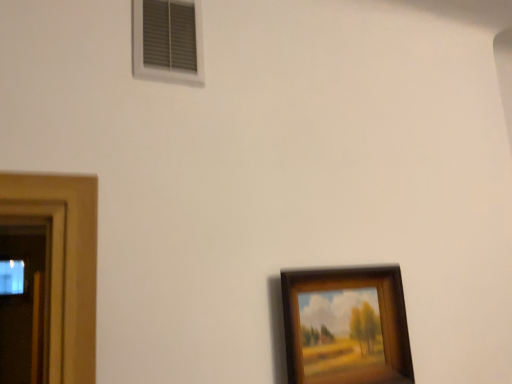
Question: Does white plastic vent at upper left have a lesser width compared to wooden framed painting at lower right?

Choices:
 (A) no
 (B) yes

Answer: (B)

Question: Is white plastic vent at upper left looking in the opposite direction of wooden framed painting at lower right?

Choices:
 (A) no
 (B) yes

Answer: (A)

Question: Is white plastic vent at upper left shorter than wooden framed painting at lower right?

Choices:
 (A) no
 (B) yes

Answer: (B)

Question: Can you confirm if white plastic vent at upper left is bigger than wooden framed painting at lower right?

Choices:
 (A) no
 (B) yes

Answer: (A)

Question: Considering the relative sizes of white plastic vent at upper left and wooden framed painting at lower right in the image provided, is white plastic vent at upper left taller than wooden framed painting at lower right?

Choices:
 (A) yes
 (B) no

Answer: (B)

Question: Can you confirm if white plastic vent at upper left is smaller than wooden framed painting at lower right?

Choices:
 (A) no
 (B) yes

Answer: (B)

Question: Considering the relative positions of wooden framed painting at lower right and white plastic vent at upper left in the image provided, is wooden framed painting at lower right behind white plastic vent at upper left?

Choices:
 (A) yes
 (B) no

Answer: (B)

Question: Is wooden framed painting at lower right placed right next to white plastic vent at upper left?

Choices:
 (A) yes
 (B) no

Answer: (B)

Question: Is wooden framed painting at lower right oriented towards white plastic vent at upper left?

Choices:
 (A) yes
 (B) no

Answer: (B)

Question: Can you confirm if wooden framed painting at lower right is wider than white plastic vent at upper left?

Choices:
 (A) yes
 (B) no

Answer: (A)

Question: Can you confirm if wooden framed painting at lower right is taller than white plastic vent at upper left?

Choices:
 (A) yes
 (B) no

Answer: (A)

Question: From a real-world perspective, is wooden framed painting at lower right under white plastic vent at upper left?

Choices:
 (A) no
 (B) yes

Answer: (B)

Question: Does point (353, 284) appear closer or farther from the camera than point (157, 4)?

Choices:
 (A) closer
 (B) farther

Answer: (B)